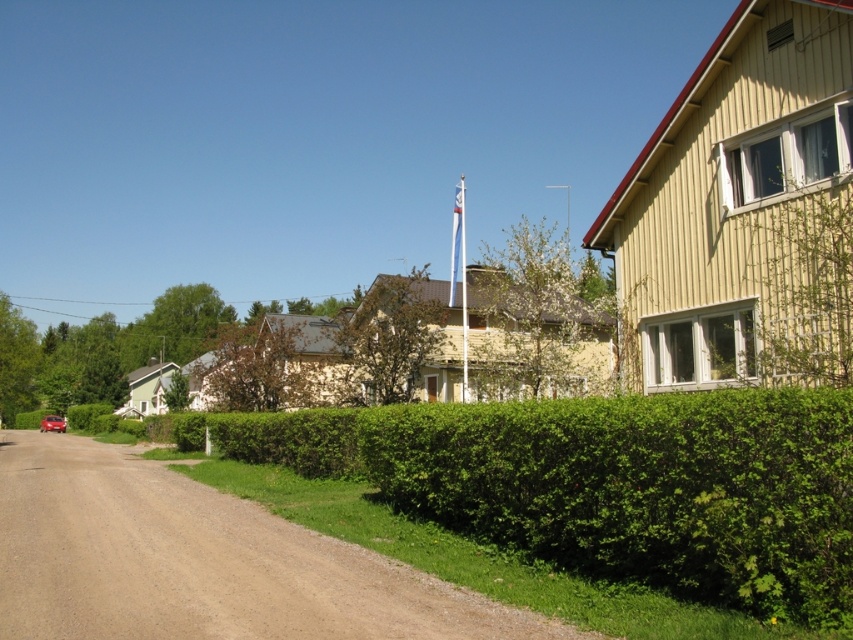
You are a delivery driver who needs to park your shiny red car at lower left near the white fabric flag at center. Given that the flag is larger than the car, can you safely park your car close to the flag without blocking the flag from view?

The white fabric flag at center is larger than the shiny red car at lower left, so you can park the shiny red car at lower left close to the flag without blocking it completely since the flag is bigger and more visible.

You are driving a delivery van that is 6 meters long. You need to make a turn around the green leafy hedge at center and the shiny red car at lower left. Considering their sizes, can your van fit through the space between them without hitting either?

The green leafy hedge at center is larger in size than the shiny red car at lower left. However, the question is about fitting through the space between them, but the description only provides their relative sizes, not the distance between them. Therefore, it is impossible to determine if the van can fit based on the given information.

You are standing in the middle of the dirt road and see the green leafy hedge at center and the shiny red car at lower left. Which object is nearer to you?

The green leafy hedge at center is closer to the viewer than the shiny red car at lower left, so the green leafy hedge at center is nearer to you.